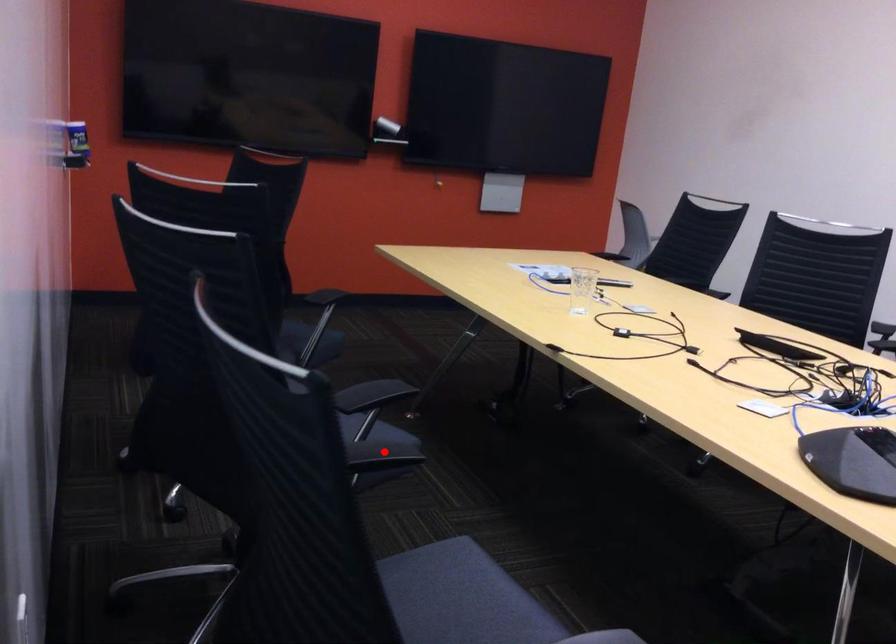
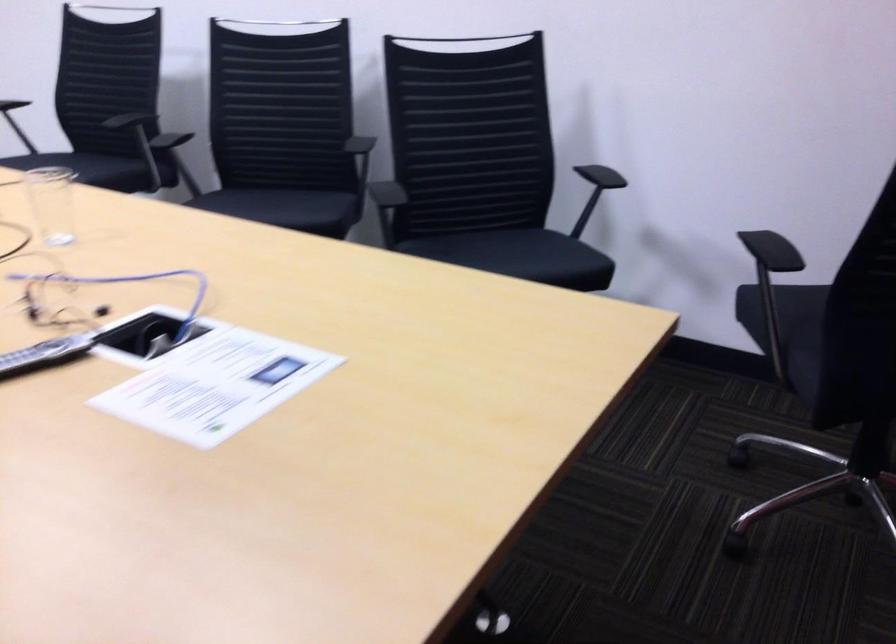
Question: I am providing you with two images of the same scene from different viewpoints. A red point is marked on the first image. Can you still see the location of the red point in image 2?

Choices:
 (A) Yes
 (B) No

Answer: (B)